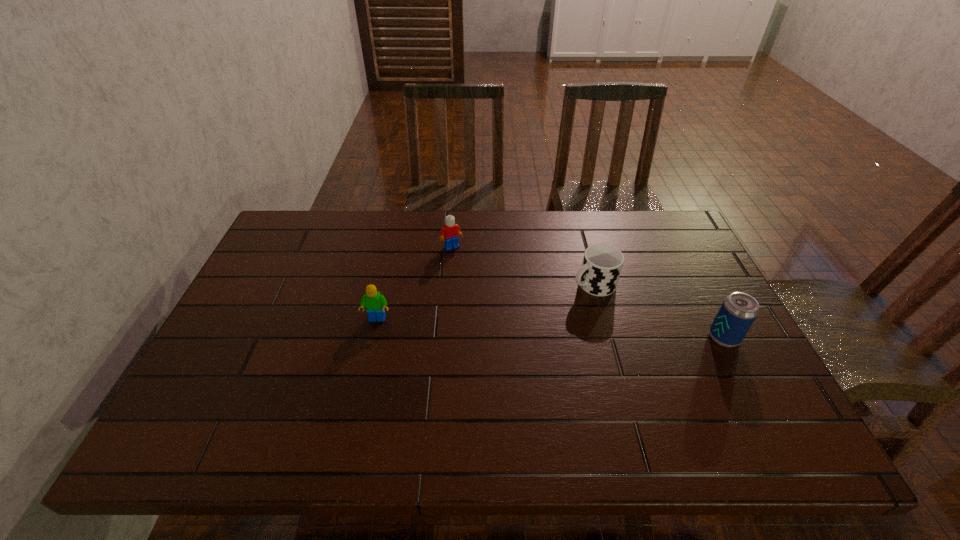
Image resolution: width=960 pixels, height=540 pixels. In order to click on free point located on the face of the farther Lego in this screenshot , I will do `click(468, 270)`.

Where is `vacant space located 0.260m on the face of the farther Lego`? vacant space located 0.260m on the face of the farther Lego is located at coordinates (492, 306).

The height and width of the screenshot is (540, 960). I want to click on free point located 0.400m on the face of the farther Lego, so click(x=517, y=343).

Locate an element on the screen. This screenshot has width=960, height=540. free space located on the side of the second farthest object with the handle is located at coordinates (543, 306).

Locate an element on the screen. The height and width of the screenshot is (540, 960). vacant position located on the side of the second farthest object with the handle is located at coordinates (478, 337).

The height and width of the screenshot is (540, 960). What are the coordinates of `free region located on the side of the second farthest object with the handle` in the screenshot? It's located at (461, 345).

Identify the location of object present at the far edge. The height and width of the screenshot is (540, 960). (449, 234).

This screenshot has width=960, height=540. Find the location of `object at the right edge`. object at the right edge is located at coordinates (738, 311).

Locate an element on the screen. This screenshot has width=960, height=540. vacant space at the far edge of the desktop is located at coordinates (347, 224).

At what (x,y) coordinates should I click in order to perform the action: click on free space at the near edge of the desktop. Please return your answer as a coordinate pair (x, y). This screenshot has height=540, width=960. Looking at the image, I should click on 688,395.